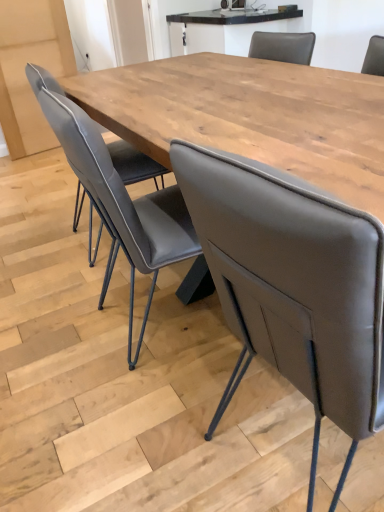
Question: Which direction should I rotate to face light brown wood table at upper center, which is counted as the first table, starting from the top, — up or down?

Choices:
 (A) up
 (B) down

Answer: (A)

Question: From the image's perspective, is matte gray leather chair at center, the 1th chair positioned from the left, below wooden table at center, which is counted as the second table, starting from the back?

Choices:
 (A) yes
 (B) no

Answer: (A)

Question: Can you confirm if matte gray leather chair at center, arranged as the 2th chair when viewed from the right, is positioned to the left of wooden table at center, which is counted as the second table, starting from the back?

Choices:
 (A) no
 (B) yes

Answer: (B)

Question: Does matte gray leather chair at center, arranged as the 2th chair when viewed from the right, have a smaller size compared to wooden table at center, which is counted as the second table, starting from the back?

Choices:
 (A) no
 (B) yes

Answer: (B)

Question: Can you confirm if matte gray leather chair at center, the 1th chair positioned from the left, is shorter than wooden table at center, which is counted as the second table, starting from the back?

Choices:
 (A) no
 (B) yes

Answer: (A)

Question: Can you confirm if matte gray leather chair at center, arranged as the 2th chair when viewed from the right, is thinner than wooden table at center, which is the 1th table from front to back?

Choices:
 (A) no
 (B) yes

Answer: (B)

Question: Considering the relative sizes of matte gray leather chair at center, arranged as the 2th chair when viewed from the right, and wooden table at center, which is counted as the second table, starting from the back, in the image provided, is matte gray leather chair at center, arranged as the 2th chair when viewed from the right, taller than wooden table at center, which is counted as the second table, starting from the back,?

Choices:
 (A) yes
 (B) no

Answer: (A)

Question: Can you confirm if matte gray chair at center, arranged as the first chair when viewed from the right, is taller than matte gray leather chair at center, the 1th chair positioned from the left?

Choices:
 (A) yes
 (B) no

Answer: (A)

Question: Does matte gray chair at center, arranged as the first chair when viewed from the right, have a lesser width compared to matte gray leather chair at center, arranged as the 2th chair when viewed from the right?

Choices:
 (A) no
 (B) yes

Answer: (A)

Question: Is matte gray chair at center, arranged as the first chair when viewed from the right, oriented towards matte gray leather chair at center, arranged as the 2th chair when viewed from the right?

Choices:
 (A) yes
 (B) no

Answer: (B)

Question: Is matte gray chair at center, arranged as the first chair when viewed from the right, at the right side of matte gray leather chair at center, the 1th chair positioned from the left?

Choices:
 (A) yes
 (B) no

Answer: (A)

Question: Is matte gray chair at center, the 2th chair in the left-to-right sequence, placed right next to matte gray leather chair at center, arranged as the 2th chair when viewed from the right?

Choices:
 (A) no
 (B) yes

Answer: (A)

Question: From the image's perspective, is matte gray chair at center, arranged as the first chair when viewed from the right, above matte gray leather chair at center, arranged as the 2th chair when viewed from the right?

Choices:
 (A) no
 (B) yes

Answer: (A)

Question: Considering the relative positions of matte gray leather chair at center, arranged as the 2th chair when viewed from the right, and light brown wood table at upper center, the 1th table viewed from the back, in the image provided, is matte gray leather chair at center, arranged as the 2th chair when viewed from the right, to the right of light brown wood table at upper center, the 1th table viewed from the back, from the viewer's perspective?

Choices:
 (A) yes
 (B) no

Answer: (B)